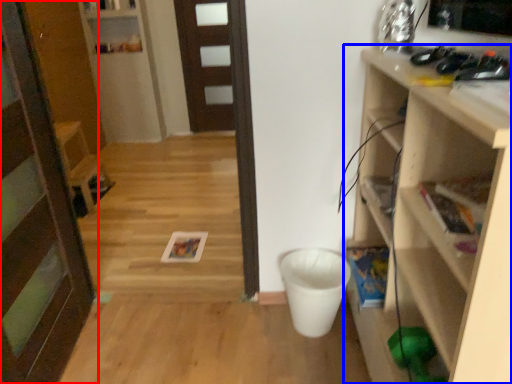
Question: Which of the following is the closest to the observer, door (highlighted by a red box) or shelf (highlighted by a blue box)?

Choices:
 (A) door
 (B) shelf

Answer: (B)